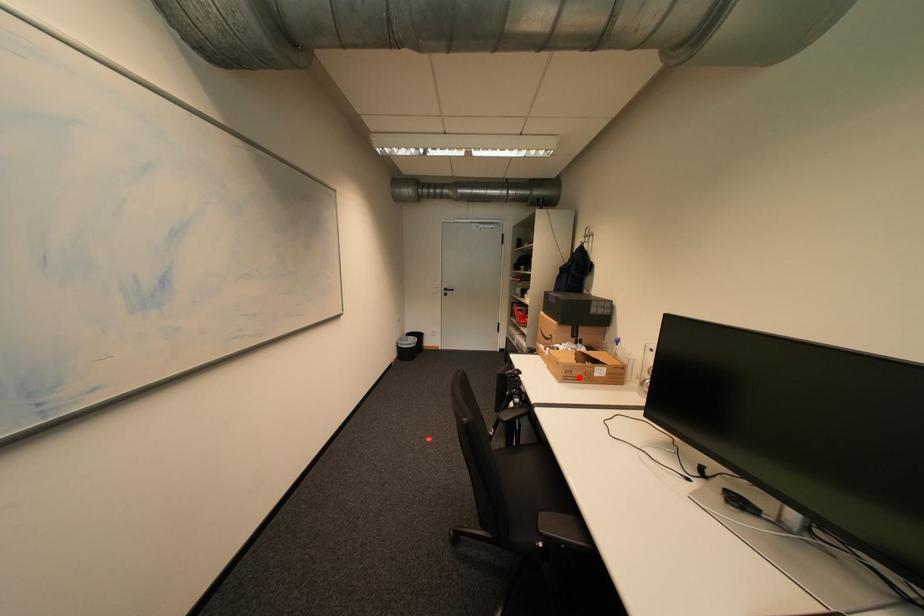
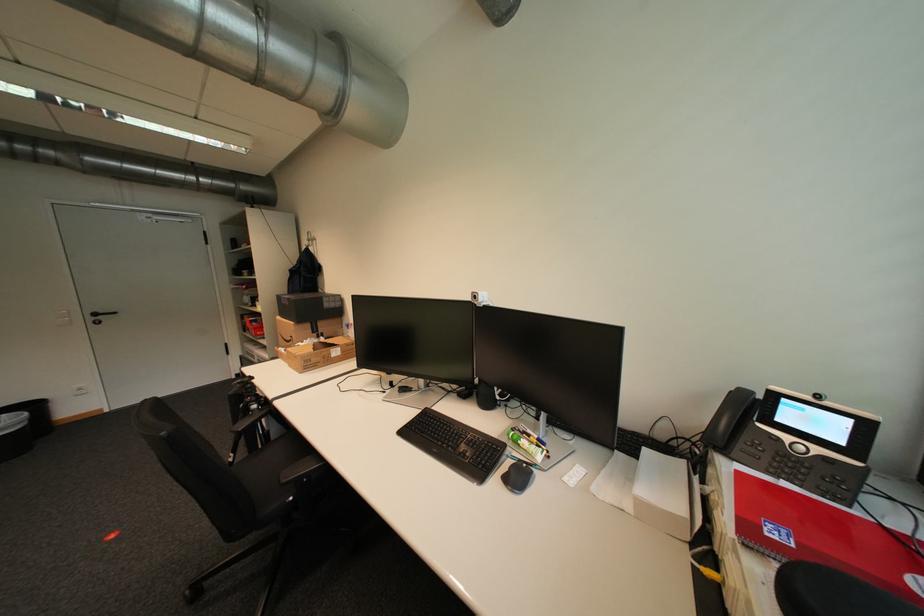
In the second image, find the point that corresponds to the highlighted location in the first image.

(319, 365)